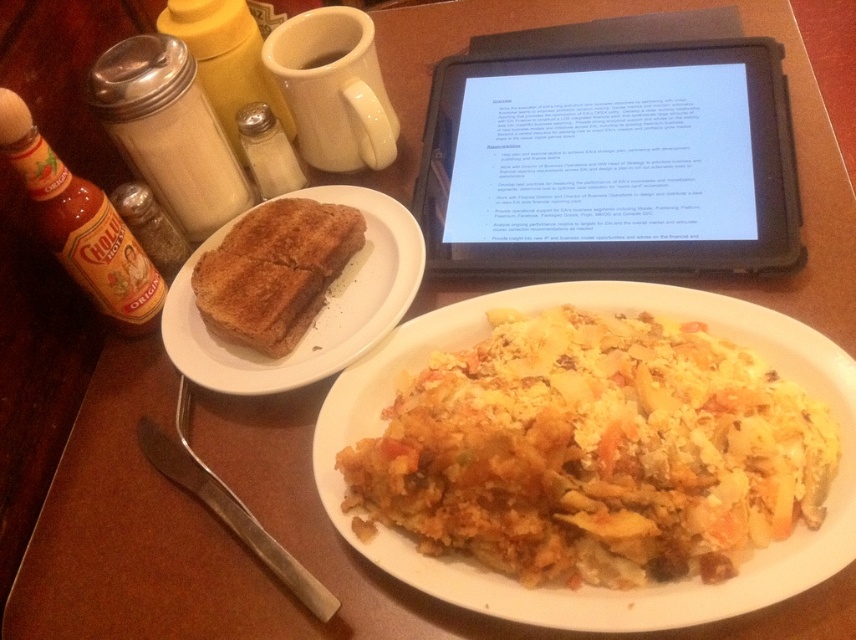
Is point (586, 51) behind point (244, 352)?

Yes, it is.

Can you confirm if black plastic tablet at upper center is positioned to the left of brown toasted bread at left?

Incorrect, black plastic tablet at upper center is not on the left side of brown toasted bread at left.

Locate an element on the screen. black plastic tablet at upper center is located at coordinates (611, 161).

What are the coordinates of `black plastic tablet at upper center` in the screenshot? It's located at (611, 161).

Between yellow cheesy pasta at center and brown toasted bread at left, which one appears on the right side from the viewer's perspective?

Positioned to the right is yellow cheesy pasta at center.

Between point (480, 364) and point (390, 205), which one is positioned in front?

Point (480, 364) is more forward.

You are a GUI agent. You are given a task and a screenshot of the screen. Output one action in this format:
    pyautogui.click(x=<x>, y=<y>)
    Task: Click on the yellow cheesy pasta at center
    
    Given the screenshot: What is the action you would take?
    pyautogui.click(x=593, y=452)

Who is positioned more to the left, yellow cheesy pasta at center or black plastic tablet at upper center?

yellow cheesy pasta at center

Between yellow cheesy pasta at center and black plastic tablet at upper center, which one has more height?

With more height is black plastic tablet at upper center.

Measure the distance between yellow cheesy pasta at center and camera.

yellow cheesy pasta at center and camera are 49.45 centimeters apart from each other.

In order to click on yellow cheesy pasta at center in this screenshot , I will do `click(593, 452)`.